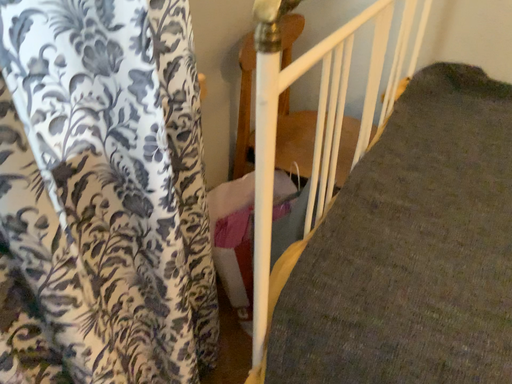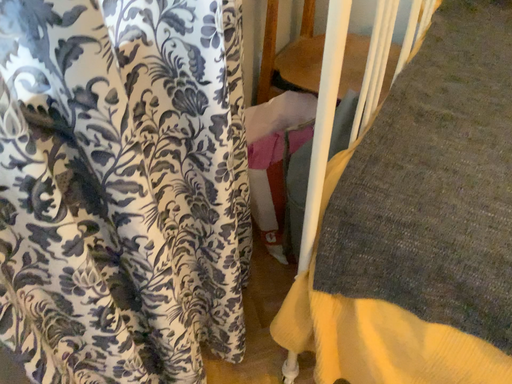
Question: Which way did the camera rotate in the video?

Choices:
 (A) rotated upward
 (B) rotated downward

Answer: (B)